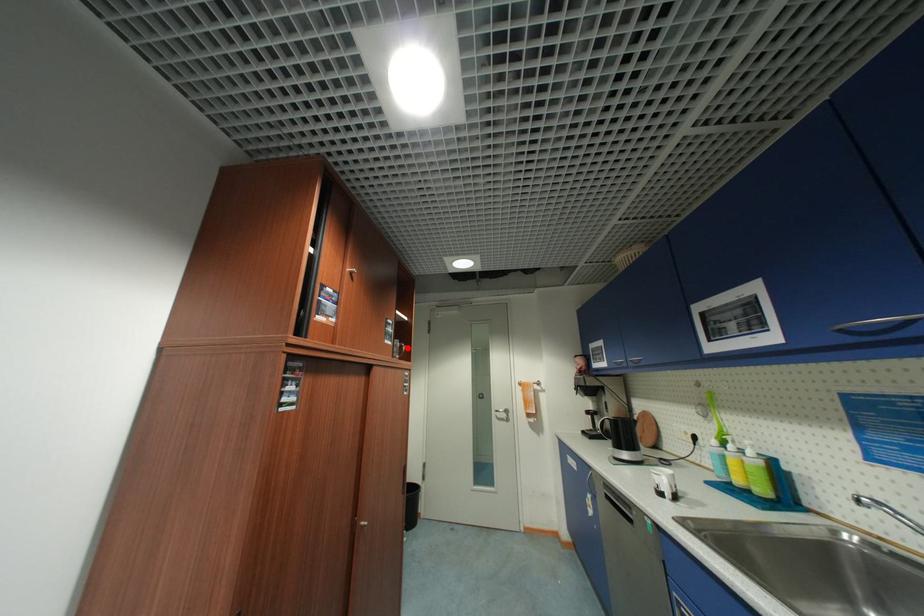
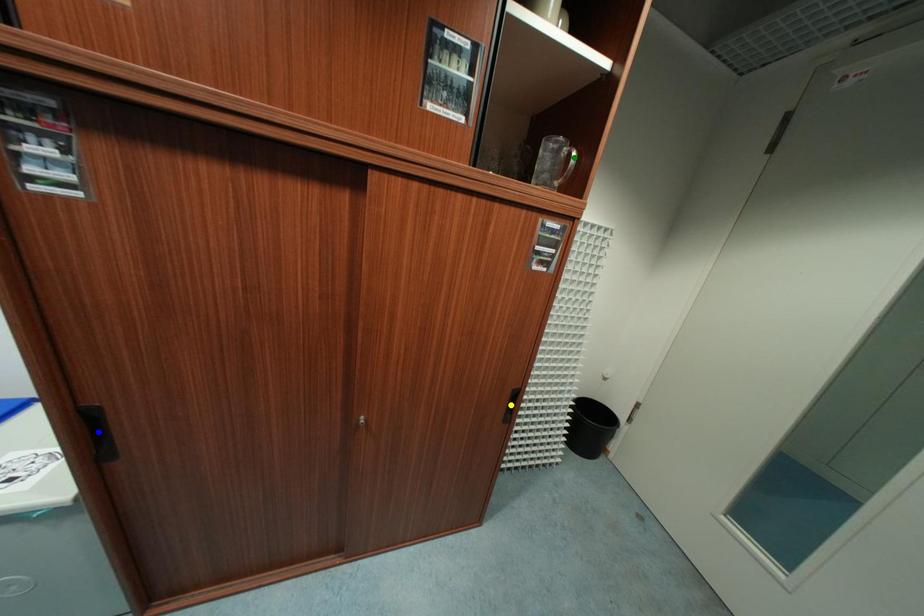
Question: I am providing you with two images of the same scene from different viewpoints. A red point is marked on the first image. You are given multiple points on the second image. Which spot in image 2 lines up with the point in image 1?

Choices:
 (A) green point
 (B) yellow point
 (C) blue point

Answer: (A)